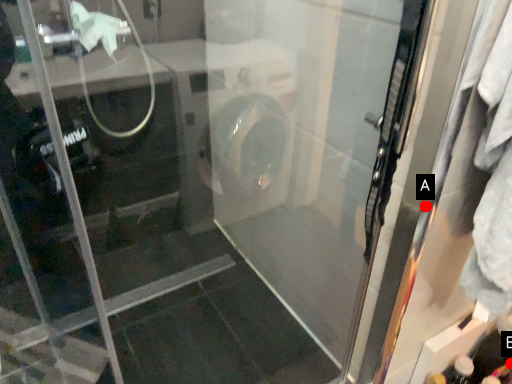
Question: Two points are circled on the image, labeled by A and B beside each circle. Which point is closer to the camera?

Choices:
 (A) A is closer
 (B) B is closer

Answer: (A)